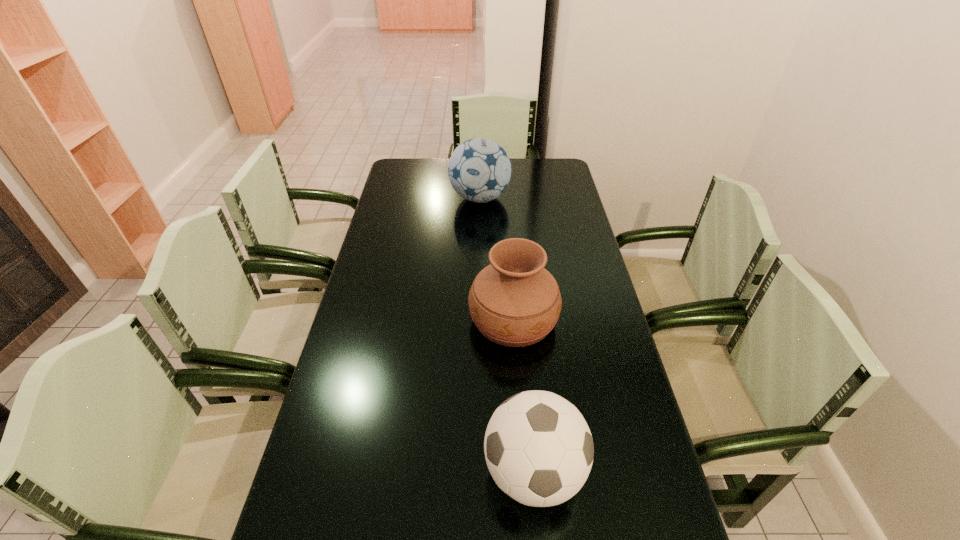
The height and width of the screenshot is (540, 960). In order to click on free spot at the right edge of the desktop in this screenshot , I will do `click(626, 452)`.

Point out which object is positioned as the second nearest to the farthest object. Please provide its 2D coordinates. Your answer should be formatted as a tuple, i.e. [(x, y)], where the tuple contains the x and y coordinates of a point satisfying the conditions above.

[(539, 450)]

Select which object appears as the second closest to the nearer soccer ball. Please provide its 2D coordinates. Your answer should be formatted as a tuple, i.e. [(x, y)], where the tuple contains the x and y coordinates of a point satisfying the conditions above.

[(479, 170)]

Locate an element on the screen. The width and height of the screenshot is (960, 540). vacant region that satisfies the following two spatial constraints: 1. on the front side of the urn; 2. on the left side of the nearest object is located at coordinates (525, 471).

At what (x,y) coordinates should I click in order to perform the action: click on free region that satisfies the following two spatial constraints: 1. on the side with brand of the farther soccer ball; 2. on the right side of the urn. Please return your answer as a coordinate pair (x, y). Looking at the image, I should click on (480, 319).

Locate an element on the screen. vacant region that satisfies the following two spatial constraints: 1. on the side with brand of the farthest object; 2. on the right side of the second farthest object is located at coordinates (480, 319).

Identify the location of blank area in the image that satisfies the following two spatial constraints: 1. on the side with brand of the farther soccer ball; 2. on the right side of the urn. (480, 319).

Find the location of a particular element. free space that satisfies the following two spatial constraints: 1. on the side with brand of the urn; 2. on the left side of the farthest object is located at coordinates (480, 319).

The height and width of the screenshot is (540, 960). Find the location of `vacant area that satisfies the following two spatial constraints: 1. on the side with brand of the second farthest object; 2. on the left side of the farthest object`. vacant area that satisfies the following two spatial constraints: 1. on the side with brand of the second farthest object; 2. on the left side of the farthest object is located at coordinates point(480,319).

I want to click on free spot that satisfies the following two spatial constraints: 1. on the side with brand of the nearest object; 2. on the left side of the farther soccer ball, so 480,471.